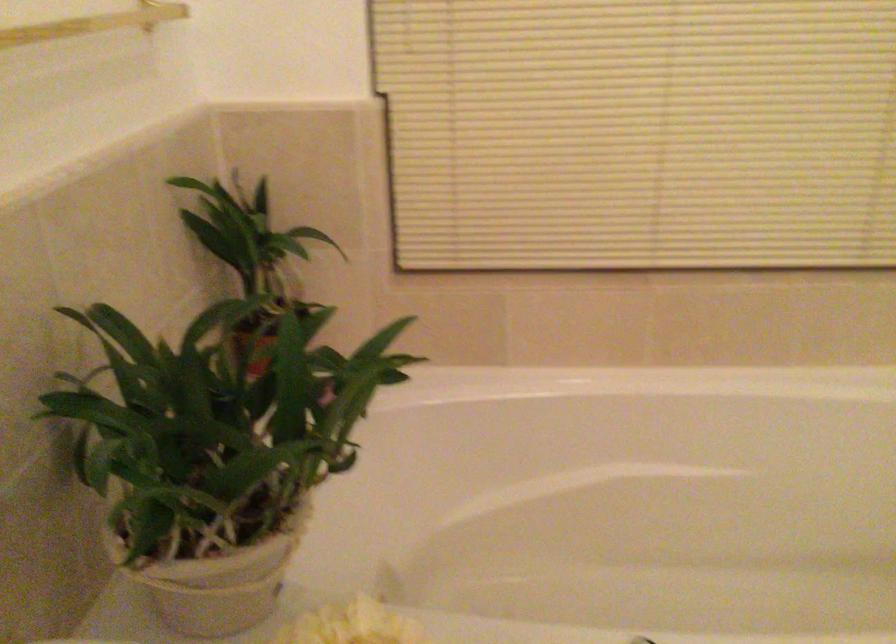
Describe the element at coordinates (351, 625) in the screenshot. Image resolution: width=896 pixels, height=644 pixels. I see `the yellow bath sponge` at that location.